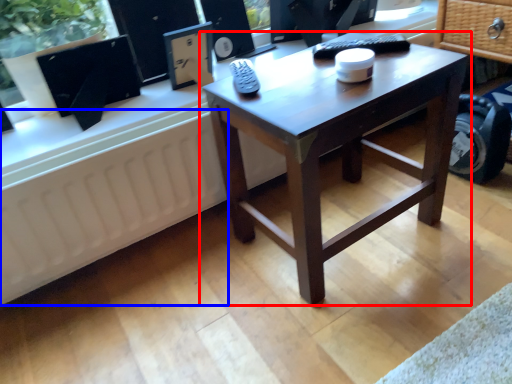
Question: Among these objects, which one is nearest to the camera, coffee table (highlighted by a red box) or radiator (highlighted by a blue box)?

Choices:
 (A) coffee table
 (B) radiator

Answer: (A)